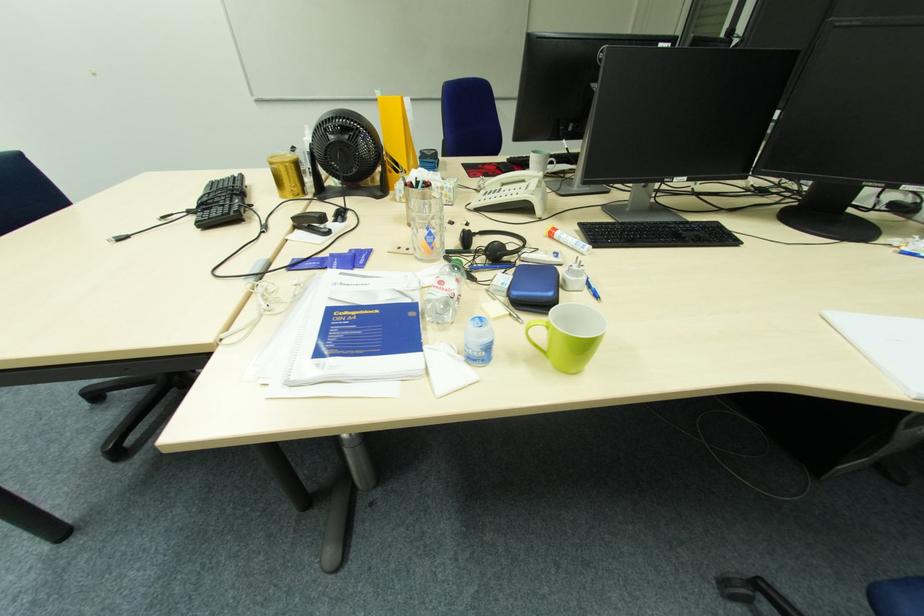
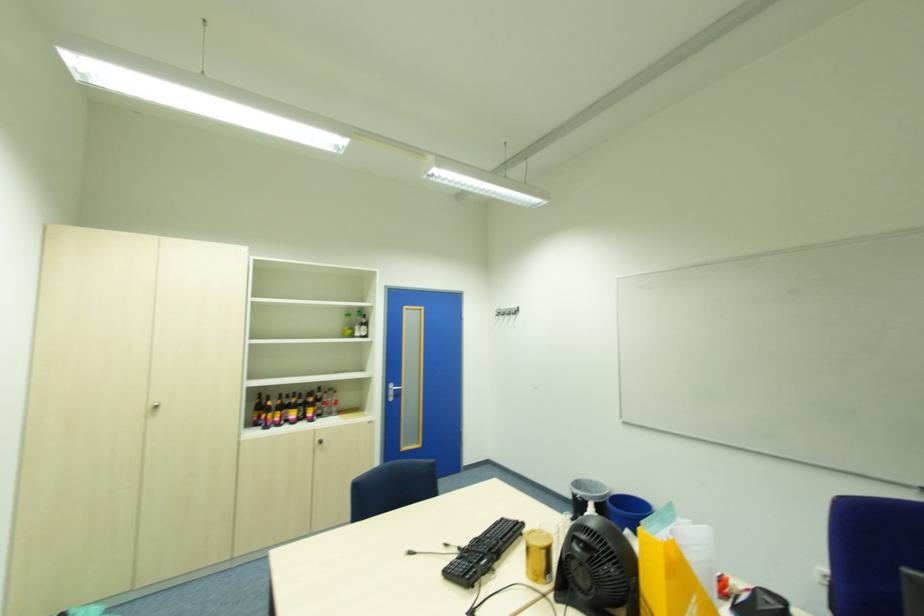
First-person continuous shooting, in which direction is the camera rotating?

The rotation direction of the camera is left-up.